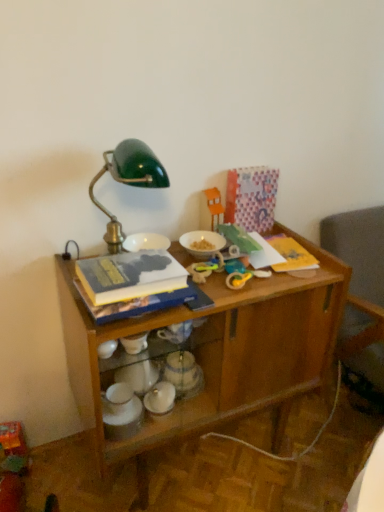
Question: Is orange plastic toy at upper center, the 1th toy in the top-to-bottom sequence, taller or shorter than white glossy bowls at lower center, positioned as the 1th tableware in bottom-to-top order?

Choices:
 (A) tall
 (B) short

Answer: (A)

Question: From a real-world perspective, is orange plastic toy at upper center, the 1th toy in the top-to-bottom sequence, above or below white glossy bowls at lower center, which is the third tableware in top-to-bottom order?

Choices:
 (A) above
 (B) below

Answer: (A)

Question: Based on their relative distances, which object is farther from the metallic silver teapot at center, placed as the 2th tableware when sorted from top to bottom?

Choices:
 (A) white glossy bowls at lower center, the first tableware viewed from the left
 (B) wooden desk at center
 (C) white matte bowl at center, the 3th tableware from the bottom
 (D) hardcover book at center
 (E) orange plastic toy at upper center, the 1th toy in the top-to-bottom sequence

Answer: (E)

Question: Which object is the closest to the white matte bowl at center, the 3th tableware from the bottom?

Choices:
 (A) white glossy bowls at lower center, the first tableware viewed from the left
 (B) rubber yellow toy at center, which is the 2th toy from front to back
 (C) hardcover book at center
 (D) wooden desk at center
 (E) metallic silver teapot at center, positioned as the second tableware in left-to-right order

Answer: (B)